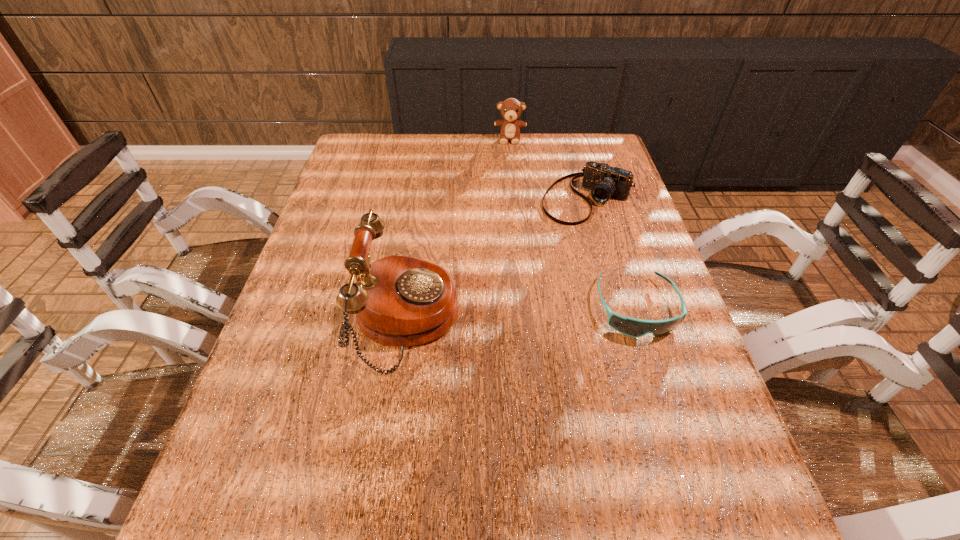
In order to click on free location at the left edge in this screenshot , I will do `click(353, 184)`.

Where is `vacant area at the right edge of the desktop`? This screenshot has height=540, width=960. vacant area at the right edge of the desktop is located at coordinates (660, 300).

Identify the location of free spot at the near left corner of the desktop. The image size is (960, 540). (295, 447).

Locate an element on the screen. Image resolution: width=960 pixels, height=540 pixels. vacant space at the far right corner of the desktop is located at coordinates (587, 158).

Locate an element on the screen. This screenshot has width=960, height=540. free spot between the teddy bear and the camera is located at coordinates (549, 168).

This screenshot has height=540, width=960. Find the location of `free area in between the telephone and the shortest object`. free area in between the telephone and the shortest object is located at coordinates (521, 313).

The height and width of the screenshot is (540, 960). Identify the location of free space between the second farthest object and the leftmost object. (497, 259).

At what (x,y) coordinates should I click in order to perform the action: click on vacant space in between the shortest object and the third nearest object. Please return your answer as a coordinate pair (x, y). Image resolution: width=960 pixels, height=540 pixels. Looking at the image, I should click on (612, 253).

Locate an element on the screen. The width and height of the screenshot is (960, 540). vacant space that is in between the telephone and the shortest object is located at coordinates (521, 313).

This screenshot has width=960, height=540. Find the location of `empty location between the shortest object and the tallest object`. empty location between the shortest object and the tallest object is located at coordinates point(521,313).